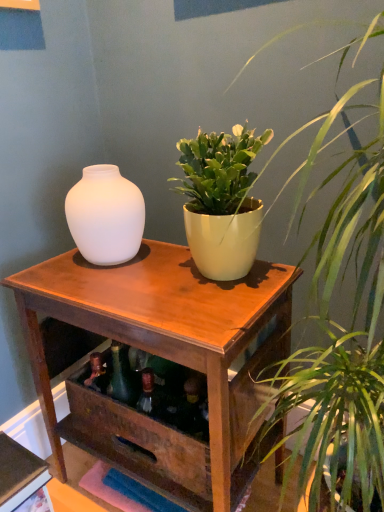
The width and height of the screenshot is (384, 512). I want to click on free space to the left of green matte plant pot at center, marked as the 1th houseplant in a top-to-bottom arrangement, so click(x=125, y=286).